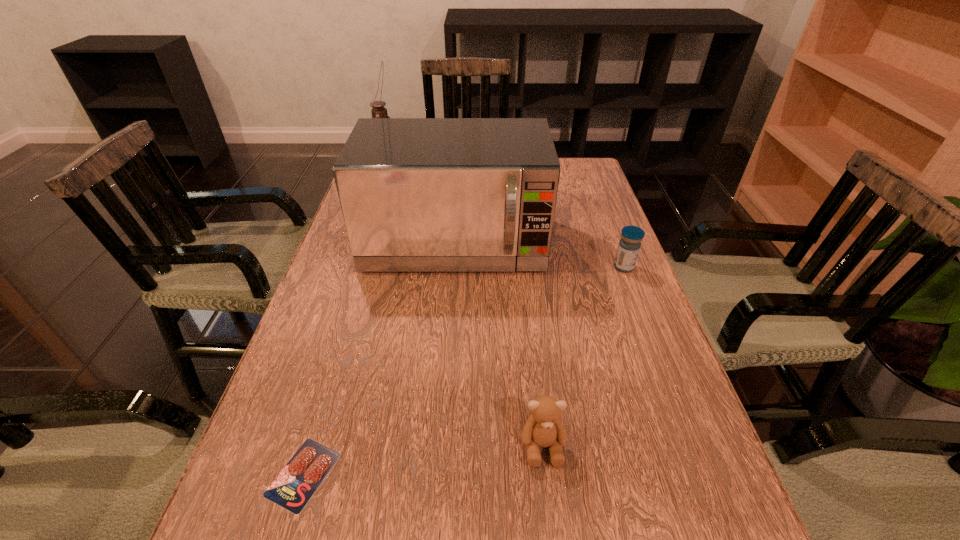
Identify the location of oil lamp. The image size is (960, 540). (378, 111).

The height and width of the screenshot is (540, 960). Find the location of `the farthest object`. the farthest object is located at coordinates (378, 111).

I want to click on the fourth shortest object, so click(x=417, y=194).

You are a GUI agent. You are given a task and a screenshot of the screen. Output one action in this format:
    pyautogui.click(x=<x>, y=<y>)
    Task: Click on the medicine
    
    Given the screenshot: What is the action you would take?
    pyautogui.click(x=629, y=246)

This screenshot has height=540, width=960. I want to click on teddy bear, so click(x=544, y=428).

Locate an element on the screen. The width and height of the screenshot is (960, 540). salami is located at coordinates (294, 486).

You are a GUI agent. You are given a task and a screenshot of the screen. Output one action in this format:
    pyautogui.click(x=<x>, y=<y>)
    Task: Click on the free space located on the right of the farthest object
    
    Given the screenshot: What is the action you would take?
    pyautogui.click(x=443, y=167)

Identify the location of free spot located 0.190m with the door open on the fourth shortest object. The image size is (960, 540). (447, 345).

What are the coordinates of `vacant space located on the front of the rightmost object` in the screenshot? It's located at (648, 330).

Locate an element on the screen. This screenshot has width=960, height=540. free region located on the face of the teddy bear is located at coordinates (552, 530).